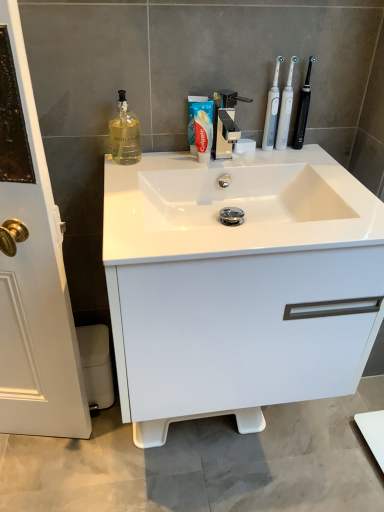
Where is `vacant space in front of white plastic toothbrush at upper right, the second toothbrush viewed from the right`? This screenshot has height=512, width=384. vacant space in front of white plastic toothbrush at upper right, the second toothbrush viewed from the right is located at coordinates (298, 168).